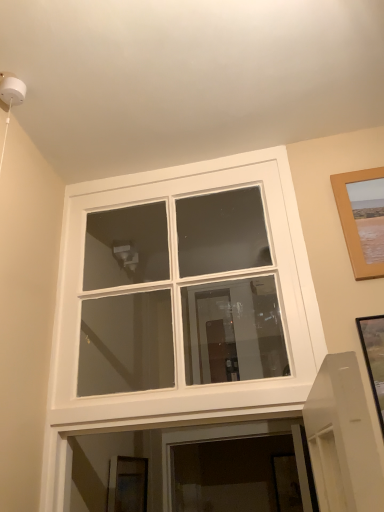
How much space does wooden picture frame at upper right, arranged as the first picture frame when viewed from the top, occupy vertically?

15.34 inches.

The image size is (384, 512). Describe the element at coordinates (360, 222) in the screenshot. I see `wooden picture frame at upper right, which is counted as the second picture frame, starting from the bottom` at that location.

Locate an element on the screen. wooden picture frame at lower center, which ranks as the 1th picture frame in back-to-front order is located at coordinates (127, 484).

In the image, is wooden picture frame at lower center, which ranks as the 1th picture frame in back-to-front order, on the left side or the right side of wooden picture frame at upper right, which appears as the 2th picture frame when viewed from the back?

In the image, wooden picture frame at lower center, which ranks as the 1th picture frame in back-to-front order, appears on the left side of wooden picture frame at upper right, which appears as the 2th picture frame when viewed from the back.

The height and width of the screenshot is (512, 384). Find the location of `picture frame below the wooden picture frame at upper right, which ranks as the first picture frame in front-to-back order (from the image's perspective)`. picture frame below the wooden picture frame at upper right, which ranks as the first picture frame in front-to-back order (from the image's perspective) is located at coordinates (127, 484).

Is wooden picture frame at upper right, which is counted as the second picture frame, starting from the bottom, at the back of wooden picture frame at lower center, which ranks as the 1th picture frame in back-to-front order?

No, wooden picture frame at lower center, which ranks as the 1th picture frame in back-to-front order, is not facing the opposite direction of wooden picture frame at upper right, which is counted as the second picture frame, starting from the bottom.

Is wooden picture frame at lower center, which ranks as the 1th picture frame in back-to-front order, inside white glass window at center?

No, wooden picture frame at lower center, which ranks as the 1th picture frame in back-to-front order, is not surrounded by white glass window at center.

Based on the photo, considering the sizes of objects white glass window at center and wooden picture frame at lower center, placed as the 1th picture frame when sorted from left to right, in the image provided, who is thinner, white glass window at center or wooden picture frame at lower center, placed as the 1th picture frame when sorted from left to right,?

wooden picture frame at lower center, placed as the 1th picture frame when sorted from left to right, is thinner.

Can you confirm if white glass window at center is smaller than wooden picture frame at lower center, arranged as the 2th picture frame when viewed from the top?

Actually, white glass window at center might be larger than wooden picture frame at lower center, arranged as the 2th picture frame when viewed from the top.

Is point (376, 243) closer or farther from the camera than point (134, 511)?

Point (376, 243) is positioned closer to the camera compared to point (134, 511).

Can you confirm if wooden picture frame at upper right, which is counted as the second picture frame, starting from the left, is positioned to the right of wooden picture frame at lower center, arranged as the 2th picture frame when viewed from the top?

Correct, you'll find wooden picture frame at upper right, which is counted as the second picture frame, starting from the left, to the right of wooden picture frame at lower center, arranged as the 2th picture frame when viewed from the top.

Consider the image. How different are the orientations of wooden picture frame at upper right, which is counted as the second picture frame, starting from the left, and wooden picture frame at lower center, the 1th picture frame ordered from the bottom, in degrees?

wooden picture frame at upper right, which is counted as the second picture frame, starting from the left, and wooden picture frame at lower center, the 1th picture frame ordered from the bottom, are facing 91.5 degrees away from each other.

Based on their positions, is wooden picture frame at upper right, the first picture frame from the right, located to the left or right of white glass window at center?

wooden picture frame at upper right, the first picture frame from the right, is positioned on white glass window at center's right side.

What's the angular difference between wooden picture frame at upper right, which appears as the 2th picture frame when viewed from the back, and white glass window at center's facing directions?

The facing directions of wooden picture frame at upper right, which appears as the 2th picture frame when viewed from the back, and white glass window at center are 0.579 degrees apart.

Is wooden picture frame at upper right, which is counted as the second picture frame, starting from the bottom, located outside white glass window at center?

Yes, wooden picture frame at upper right, which is counted as the second picture frame, starting from the bottom, is outside of white glass window at center.

From the image's perspective, is wooden picture frame at upper right, the first picture frame from the right, positioned above or below white glass window at center?

From the image's perspective, wooden picture frame at upper right, the first picture frame from the right, appears above white glass window at center.

Between point (115, 489) and point (283, 153), which one is positioned behind?

The point (115, 489) is farther.

From the image's perspective, between wooden picture frame at lower center, acting as the 2th picture frame starting from the right, and white glass window at center, who is located below?

wooden picture frame at lower center, acting as the 2th picture frame starting from the right.

Considering their positions, is wooden picture frame at lower center, placed as the 1th picture frame when sorted from left to right, located in front of or behind white glass window at center?

wooden picture frame at lower center, placed as the 1th picture frame when sorted from left to right, is behind white glass window at center.

Is white glass window at center completely or partially outside of wooden picture frame at upper right, which is counted as the second picture frame, starting from the bottom?

Indeed, white glass window at center is completely outside wooden picture frame at upper right, which is counted as the second picture frame, starting from the bottom.

Does white glass window at center touch wooden picture frame at upper right, which appears as the 2th picture frame when viewed from the back?

No, white glass window at center is not next to wooden picture frame at upper right, which appears as the 2th picture frame when viewed from the back.

Which is more to the left, white glass window at center or wooden picture frame at upper right, which is counted as the second picture frame, starting from the bottom?

Positioned to the left is white glass window at center.

Considering the sizes of objects white glass window at center and wooden picture frame at upper right, which is counted as the second picture frame, starting from the left, in the image provided, who is shorter, white glass window at center or wooden picture frame at upper right, which is counted as the second picture frame, starting from the left,?

wooden picture frame at upper right, which is counted as the second picture frame, starting from the left, is shorter.

Identify the location of picture frame below the wooden picture frame at upper right, arranged as the first picture frame when viewed from the top (from a real-world perspective). pos(127,484).

In the image, there is a white glass window at center. At what (x,y) coordinates should I click in order to perform the action: click on picture frame below it (from the image's perspective). Please return your answer as a coordinate pair (x, y). Image resolution: width=384 pixels, height=512 pixels. Looking at the image, I should click on (127, 484).

When comparing their distances from wooden picture frame at lower center, acting as the 2th picture frame starting from the front, does white glass window at center or wooden picture frame at upper right, which ranks as the first picture frame in front-to-back order, seem closer?

white glass window at center is positioned closer to the anchor wooden picture frame at lower center, acting as the 2th picture frame starting from the front.

Which object lies nearer to the anchor point wooden picture frame at upper right, the first picture frame from the right, white glass window at center or wooden picture frame at lower center, acting as the 2th picture frame starting from the front?

white glass window at center is positioned closer to the anchor wooden picture frame at upper right, the first picture frame from the right.

When comparing their distances from wooden picture frame at lower center, which ranks as the 1th picture frame in back-to-front order, does wooden picture frame at upper right, which is counted as the second picture frame, starting from the left, or white glass window at center seem further?

wooden picture frame at upper right, which is counted as the second picture frame, starting from the left, is positioned further to the anchor wooden picture frame at lower center, which ranks as the 1th picture frame in back-to-front order.

Considering their positions, is wooden picture frame at lower center, acting as the 2th picture frame starting from the right, positioned closer to white glass window at center than wooden picture frame at upper right, which is counted as the second picture frame, starting from the bottom?

Based on the image, wooden picture frame at lower center, acting as the 2th picture frame starting from the right, appears to be nearer to white glass window at center.

Which object lies nearer to the anchor point white glass window at center, wooden picture frame at upper right, the first picture frame from the right, or wooden picture frame at lower center, placed as the 1th picture frame when sorted from left to right?

The object closer to white glass window at center is wooden picture frame at lower center, placed as the 1th picture frame when sorted from left to right.

From the image, which object appears to be farther from wooden picture frame at upper right, which appears as the 2th picture frame when viewed from the back, wooden picture frame at lower center, which ranks as the 1th picture frame in back-to-front order, or white glass window at center?

The object further to wooden picture frame at upper right, which appears as the 2th picture frame when viewed from the back, is wooden picture frame at lower center, which ranks as the 1th picture frame in back-to-front order.

Locate an element on the screen. The width and height of the screenshot is (384, 512). window between wooden picture frame at upper right, arranged as the first picture frame when viewed from the top, and wooden picture frame at lower center, acting as the 2th picture frame starting from the front, vertically is located at coordinates tap(184, 294).